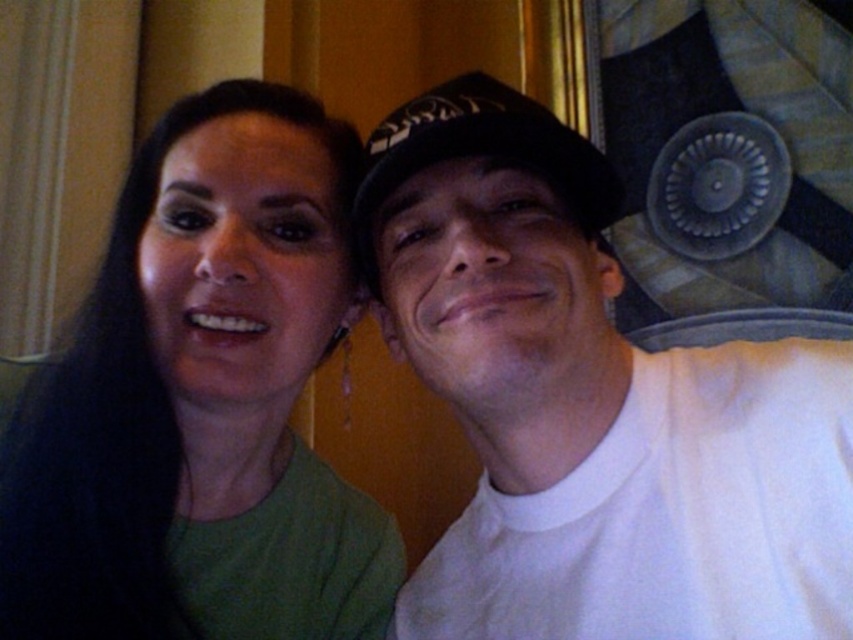
You are a photographer adjusting the lighting in the room. You need to ensure that both the green matte shirt at left and the black fabric baseball hat at center are well lit. Since the hat is behind the shirt, which object might cast a shadow on the other? Please explain.

The black fabric baseball hat at center is behind the green matte shirt at left. Since the hat is behind, if the light source is in front of the shirt, the shirt could cast a shadow on the hat. However, if the light is coming from behind, the hat might cast a shadow on the shirt. To ensure both are well lit, adjust the light source position so neither casts a shadow on the other.